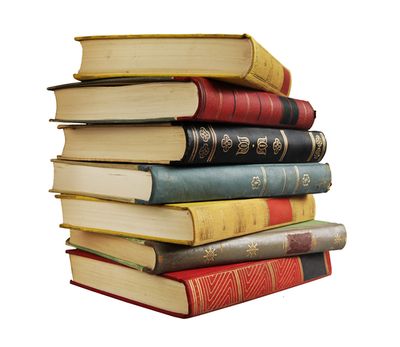
What are the coordinates of `book spine` in the screenshot? It's located at (243, 292), (250, 248), (245, 216), (235, 183), (245, 147), (255, 110), (264, 77).